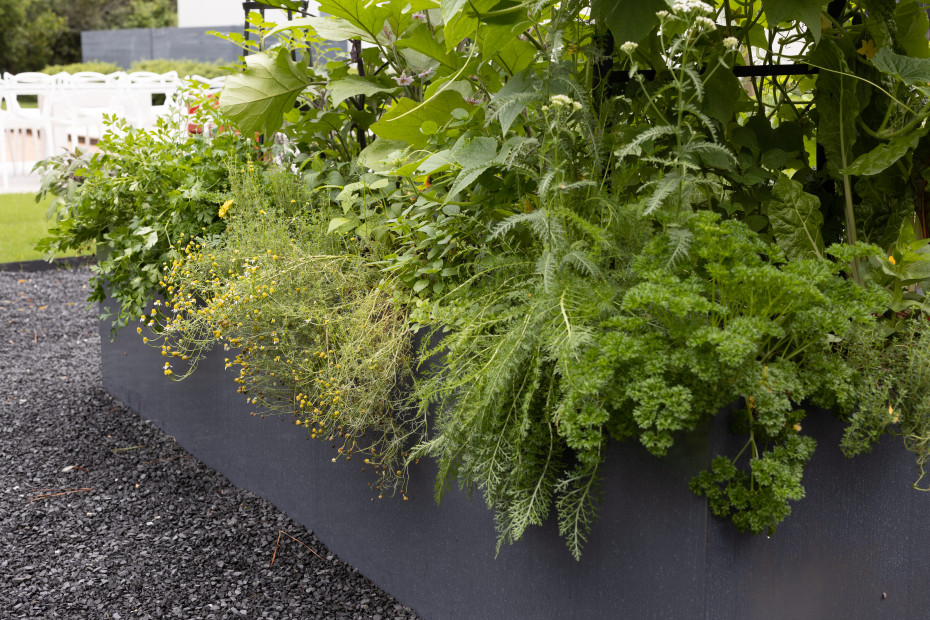
Locate an element on the screen. This screenshot has width=930, height=620. bed wall is located at coordinates (755, 574), (215, 399).